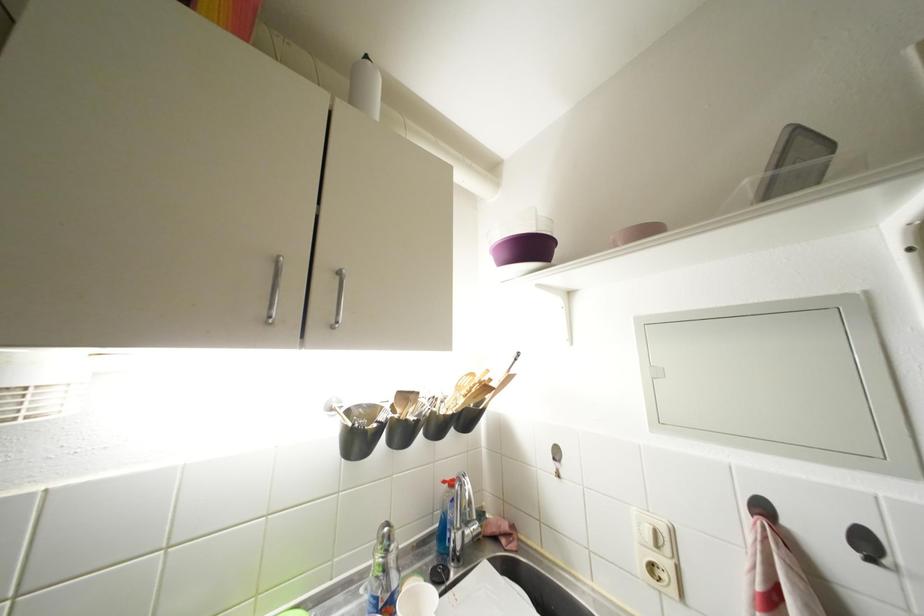
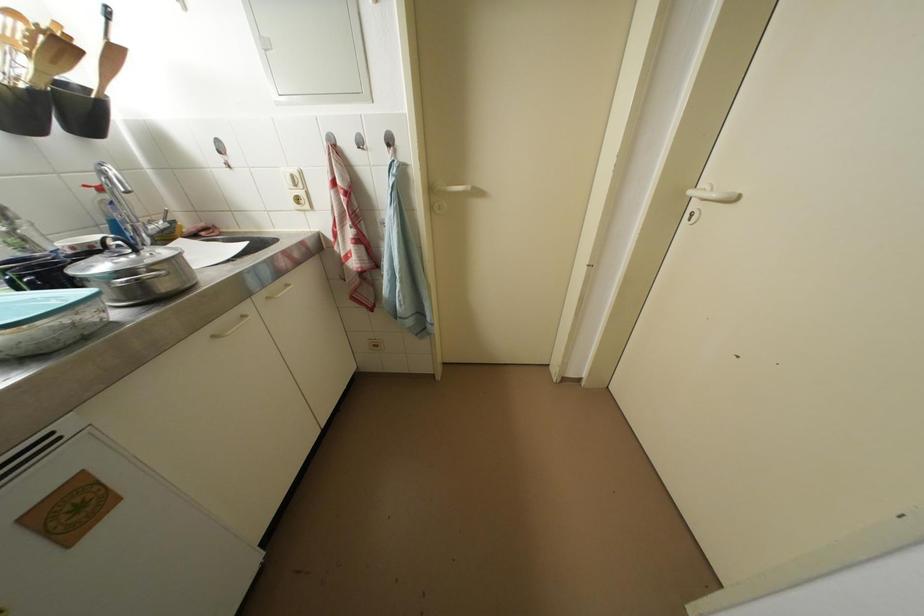
First-person continuous shooting, in which direction is the camera rotating?

The rotation direction of the camera is right-down.